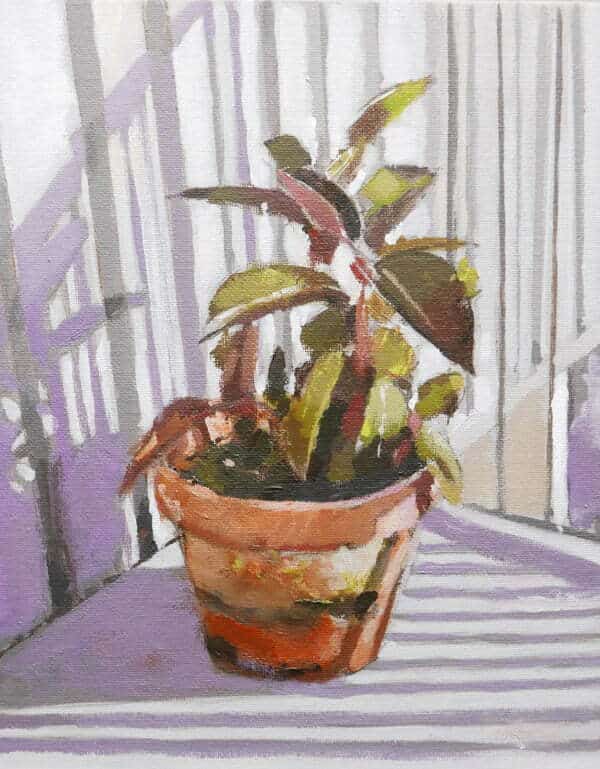
In order to click on surface on which rests the painted pot in this screenshot , I will do `click(285, 711)`.